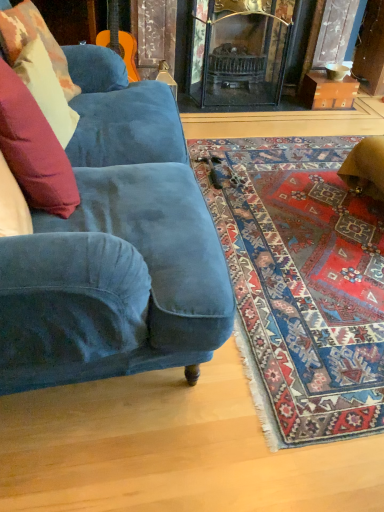
The image size is (384, 512). I want to click on carpet with intricate patterns at lower right, so click(302, 284).

Measure the distance between point [356,86] and camera.

The depth of point [356,86] is 3.29 meters.

Find the location of `velvet cushion at left, which appears as the 2th pillow when viewed from the back`. velvet cushion at left, which appears as the 2th pillow when viewed from the back is located at coordinates (46, 89).

How distant is velvet cushion at left, the 3th pillow viewed from the front, from velvet blue couch at lower left?

velvet cushion at left, the 3th pillow viewed from the front, and velvet blue couch at lower left are 57.35 centimeters apart.

Is velvet cushion at left, placed as the first pillow when sorted from back to front, next to velvet blue couch at lower left?

There is a gap between velvet cushion at left, placed as the first pillow when sorted from back to front, and velvet blue couch at lower left.

Considering the sizes of velvet cushion at left, placed as the first pillow when sorted from back to front, and velvet blue couch at lower left in the image, is velvet cushion at left, placed as the first pillow when sorted from back to front, taller or shorter than velvet blue couch at lower left?

In the image, velvet cushion at left, placed as the first pillow when sorted from back to front, appears to be shorter than velvet blue couch at lower left.

Is velvet cushion at left, the 3th pillow viewed from the front, thinner than velvet blue couch at lower left?

Yes.

Does velvet cushion at left, which appears as the 2th pillow when viewed from the back, have a greater height compared to velvet cushion at left, which is the 1th pillow in front-to-back order?

Incorrect, the height of velvet cushion at left, which appears as the 2th pillow when viewed from the back, is not larger of that of velvet cushion at left, which is the 1th pillow in front-to-back order.

Is velvet cushion at left, the second pillow in the front-to-back sequence, with velvet cushion at left, which is the 1th pillow in front-to-back order?

No, velvet cushion at left, the second pillow in the front-to-back sequence, is not next to velvet cushion at left, which is the 1th pillow in front-to-back order.

Based on the photo, is velvet cushion at left, which appears as the 2th pillow when viewed from the back, positioned with its back to velvet cushion at left, which appears as the third pillow when viewed from the back?

That's not correct — velvet cushion at left, which appears as the 2th pillow when viewed from the back, is not looking away from velvet cushion at left, which appears as the third pillow when viewed from the back.

Which object is more forward, velvet cushion at left, which appears as the 2th pillow when viewed from the back, or velvet cushion at left, which is the 1th pillow in front-to-back order?

velvet cushion at left, which is the 1th pillow in front-to-back order, is in front.

Would you say velvet blue couch at lower left is to the left or to the right of velvet cushion at left, which appears as the third pillow when viewed from the back, in the picture?

Clearly, velvet blue couch at lower left is on the right of velvet cushion at left, which appears as the third pillow when viewed from the back, in the image.

From the image's perspective, which object appears higher, velvet blue couch at lower left or velvet cushion at left, which is the 1th pillow in front-to-back order?

velvet cushion at left, which is the 1th pillow in front-to-back order, appears higher in the image.

Based on the photo, would you say velvet blue couch at lower left is a long distance from velvet cushion at left, which is the 1th pillow in front-to-back order?

No, velvet blue couch at lower left is not far from velvet cushion at left, which is the 1th pillow in front-to-back order.

Is velvet blue couch at lower left inside the boundaries of velvet cushion at left, which is the 1th pillow in front-to-back order, or outside?

velvet blue couch at lower left exists outside the volume of velvet cushion at left, which is the 1th pillow in front-to-back order.

Is the depth of velvet cushion at left, which is the 1th pillow in front-to-back order, less than that of velvet cushion at left, which appears as the 2th pillow when viewed from the back?

Yes.

I want to click on the 1st pillow above the velvet cushion at left, the second pillow in the front-to-back sequence (from a real-world perspective), so click(34, 149).

Could you tell me if velvet cushion at left, which appears as the third pillow when viewed from the back, is turned towards velvet cushion at left, which appears as the 2th pillow when viewed from the back?

No, velvet cushion at left, which appears as the third pillow when viewed from the back, does not turn towards velvet cushion at left, which appears as the 2th pillow when viewed from the back.

Consider the image. In terms of height, does velvet cushion at left, the second pillow in the front-to-back sequence, look taller or shorter compared to brown cardboard box at upper right?

In the image, velvet cushion at left, the second pillow in the front-to-back sequence, appears to be taller than brown cardboard box at upper right.

Who is more distant, velvet cushion at left, which appears as the 2th pillow when viewed from the back, or brown cardboard box at upper right?

brown cardboard box at upper right is further from the camera.

Is velvet cushion at left, which appears as the 2th pillow when viewed from the back, located outside brown cardboard box at upper right?

Yes.

Considering the relative positions of velvet cushion at left, the second pillow in the front-to-back sequence, and brown cardboard box at upper right in the image provided, is velvet cushion at left, the second pillow in the front-to-back sequence, to the right of brown cardboard box at upper right from the viewer's perspective?

In fact, velvet cushion at left, the second pillow in the front-to-back sequence, is to the left of brown cardboard box at upper right.

Considering the points (307, 72) and (214, 189), which point is in front, point (307, 72) or point (214, 189)?

The point (214, 189) is in front.

How many degrees apart are the facing directions of brown cardboard box at upper right and carpet with intricate patterns at lower right?

There is a 0.541-degree angle between the facing directions of brown cardboard box at upper right and carpet with intricate patterns at lower right.

From a real-world perspective, which object rests below the other?

carpet with intricate patterns at lower right.

Can you confirm if brown cardboard box at upper right is shorter than carpet with intricate patterns at lower right?

No, brown cardboard box at upper right is not shorter than carpet with intricate patterns at lower right.

Is velvet blue couch at lower left in front of or behind brown cardboard box at upper right in the image?

Clearly, velvet blue couch at lower left is in front of brown cardboard box at upper right.

Is velvet blue couch at lower left next to brown cardboard box at upper right and touching it?

No, velvet blue couch at lower left is not in contact with brown cardboard box at upper right.

Based on the photo, is velvet blue couch at lower left located outside brown cardboard box at upper right?

velvet blue couch at lower left is positioned outside brown cardboard box at upper right.

Considering the points (71, 331) and (318, 81), which point is behind, point (71, 331) or point (318, 81)?

Point (318, 81)

What are the coordinates of `studio couch directly beneath the velvet cushion at left, the 3th pillow viewed from the front (from a real-world perspective)` in the screenshot? It's located at (116, 248).

In the image, there is a velvet cushion at left, which appears as the 2th pillow when viewed from the back. Identify the location of pillow below it (from the image's perspective). The height and width of the screenshot is (512, 384). (34, 149).

Looking at the image, which one is located closer to carpet with intricate patterns at lower right, velvet cushion at left, which appears as the third pillow when viewed from the back, or velvet cushion at left, placed as the first pillow when sorted from back to front?

Among the two, velvet cushion at left, which appears as the third pillow when viewed from the back, is located nearer to carpet with intricate patterns at lower right.

When comparing their distances from velvet cushion at left, which is the 1th pillow in front-to-back order, does velvet cushion at left, which appears as the 2th pillow when viewed from the back, or velvet blue couch at lower left seem closer?

velvet blue couch at lower left is positioned closer to the anchor velvet cushion at left, which is the 1th pillow in front-to-back order.

Which object lies further to the anchor point velvet blue couch at lower left, carpet with intricate patterns at lower right or velvet cushion at left, which appears as the third pillow when viewed from the back?

Based on the image, carpet with intricate patterns at lower right appears to be further to velvet blue couch at lower left.

From the image, which object appears to be farther from velvet cushion at left, which is the 1th pillow in front-to-back order, velvet blue couch at lower left or velvet cushion at left, the 3th pillow viewed from the front?

velvet cushion at left, the 3th pillow viewed from the front.

From the image, which object appears to be nearer to velvet blue couch at lower left, velvet cushion at left, which is the 1th pillow in front-to-back order, or velvet cushion at left, the second pillow in the front-to-back sequence?

velvet cushion at left, which is the 1th pillow in front-to-back order, lies closer to velvet blue couch at lower left than the other object.

Estimate the real-world distances between objects in this image. Which object is further from velvet cushion at left, which appears as the 2th pillow when viewed from the back, velvet cushion at left, which appears as the third pillow when viewed from the back, or carpet with intricate patterns at lower right?

carpet with intricate patterns at lower right.

Considering their positions, is velvet cushion at left, placed as the first pillow when sorted from back to front, positioned further to velvet cushion at left, which appears as the 2th pillow when viewed from the back, than velvet blue couch at lower left?

velvet blue couch at lower left is positioned further to the anchor velvet cushion at left, which appears as the 2th pillow when viewed from the back.

From the image, which object appears to be nearer to velvet cushion at left, placed as the first pillow when sorted from back to front, carpet with intricate patterns at lower right or velvet blue couch at lower left?

velvet blue couch at lower left is closer to velvet cushion at left, placed as the first pillow when sorted from back to front.

Image resolution: width=384 pixels, height=512 pixels. Find the location of `pillow located between velvet cushion at left, which appears as the 2th pillow when viewed from the back, and brown cardboard box at upper right in the depth direction`. pillow located between velvet cushion at left, which appears as the 2th pillow when viewed from the back, and brown cardboard box at upper right in the depth direction is located at coordinates (32, 39).

Locate an element on the screen. This screenshot has height=512, width=384. studio couch located between velvet cushion at left, which is the 1th pillow in front-to-back order, and carpet with intricate patterns at lower right in the left-right direction is located at coordinates (116, 248).

Locate an element on the screen. pillow situated between velvet cushion at left, the second pillow in the front-to-back sequence, and carpet with intricate patterns at lower right from left to right is located at coordinates (34, 149).

Locate an element on the screen. The width and height of the screenshot is (384, 512). mat between velvet blue couch at lower left and brown cardboard box at upper right along the z-axis is located at coordinates (302, 284).